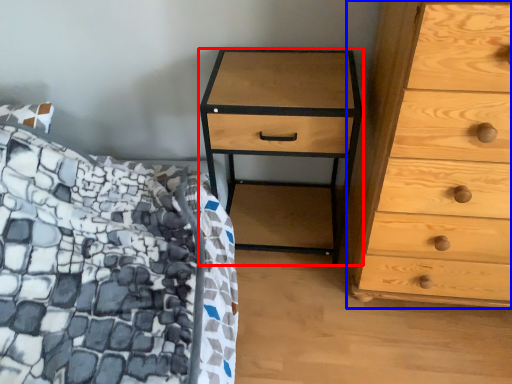
Question: Which point is closer to the camera, nightstand (highlighted by a red box) or chest of drawers (highlighted by a blue box)?

Choices:
 (A) nightstand
 (B) chest of drawers

Answer: (B)